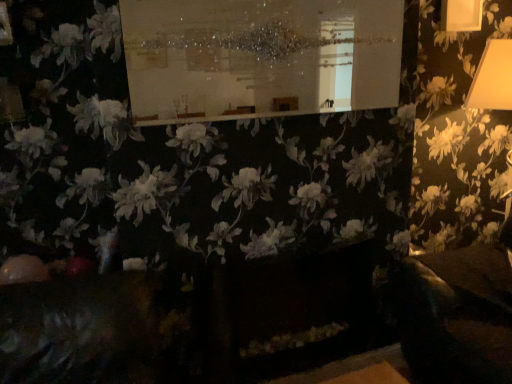
Question: In terms of height, does white glossy board at upper center look taller or shorter compared to yellow matte lampshade at right?

Choices:
 (A) tall
 (B) short

Answer: (B)

Question: From the image's perspective, relative to yellow matte lampshade at right, is white glossy board at upper center above or below?

Choices:
 (A) above
 (B) below

Answer: (A)

Question: Considering the positions of white glossy board at upper center and yellow matte lampshade at right in the image, is white glossy board at upper center bigger or smaller than yellow matte lampshade at right?

Choices:
 (A) small
 (B) big

Answer: (A)

Question: Is yellow matte lampshade at right spatially inside white glossy board at upper center, or outside of it?

Choices:
 (A) outside
 (B) inside

Answer: (A)

Question: Is yellow matte lampshade at right taller or shorter than white glossy board at upper center?

Choices:
 (A) tall
 (B) short

Answer: (A)

Question: In the image, is yellow matte lampshade at right on the left side or the right side of white glossy board at upper center?

Choices:
 (A) right
 (B) left

Answer: (A)

Question: Based on their sizes in the image, would you say yellow matte lampshade at right is bigger or smaller than white glossy board at upper center?

Choices:
 (A) small
 (B) big

Answer: (B)